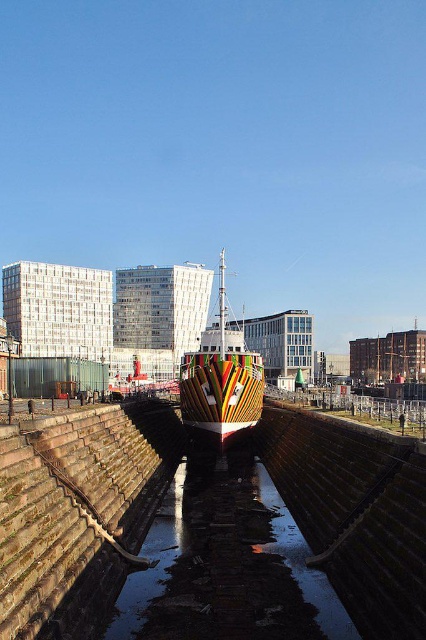
Question: In this image, where is dark reflective water at center located relative to multicolored painted ship at center?

Choices:
 (A) left
 (B) right

Answer: (B)

Question: Is dark reflective water at center smaller than multicolored painted ship at center?

Choices:
 (A) yes
 (B) no

Answer: (A)

Question: Where is dark reflective water at center located in relation to multicolored painted ship at center in the image?

Choices:
 (A) left
 (B) right

Answer: (B)